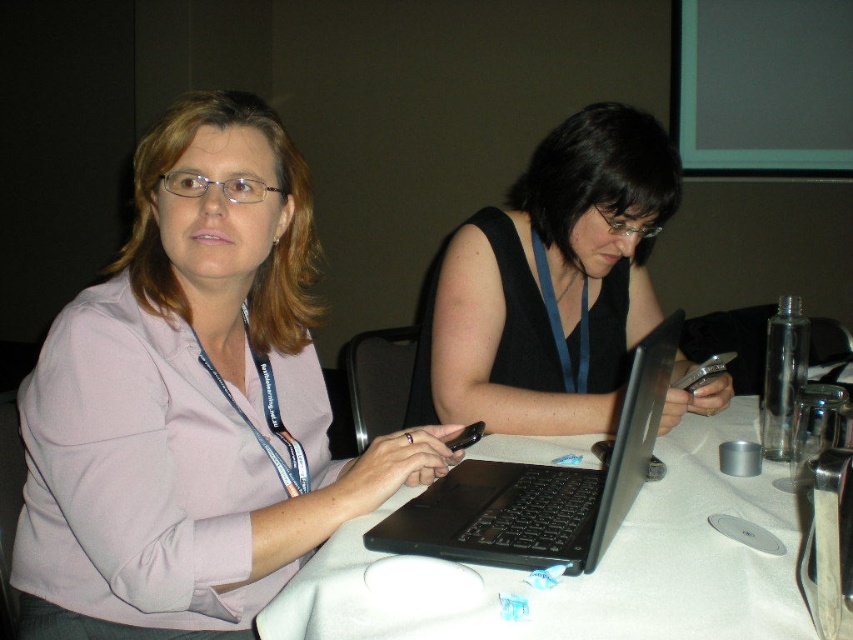
Question: Which point is farther to the camera?

Choices:
 (A) matte pink shirt at center
 (B) black matte tank top at center

Answer: (B)

Question: Is black matte tank top at center below white cloth table at center?

Choices:
 (A) yes
 (B) no

Answer: (B)

Question: Does black matte tank top at center have a greater width compared to black matte laptop at center?

Choices:
 (A) yes
 (B) no

Answer: (A)

Question: Can you confirm if matte pink shirt at center is positioned above black matte tank top at center?

Choices:
 (A) yes
 (B) no

Answer: (B)

Question: Which object appears farthest from the camera in this image?

Choices:
 (A) black matte laptop at center
 (B) white cloth table at center

Answer: (A)

Question: Which point is farther to the camera?

Choices:
 (A) (257, 621)
 (B) (643, 360)
 (C) (422, 468)

Answer: (C)